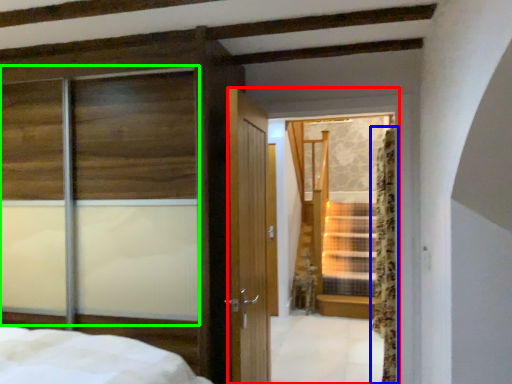
Question: Which is nearer to the glass door (highlighted by a red box)? curtain (highlighted by a blue box) or window (highlighted by a green box).

Choices:
 (A) curtain
 (B) window

Answer: (B)